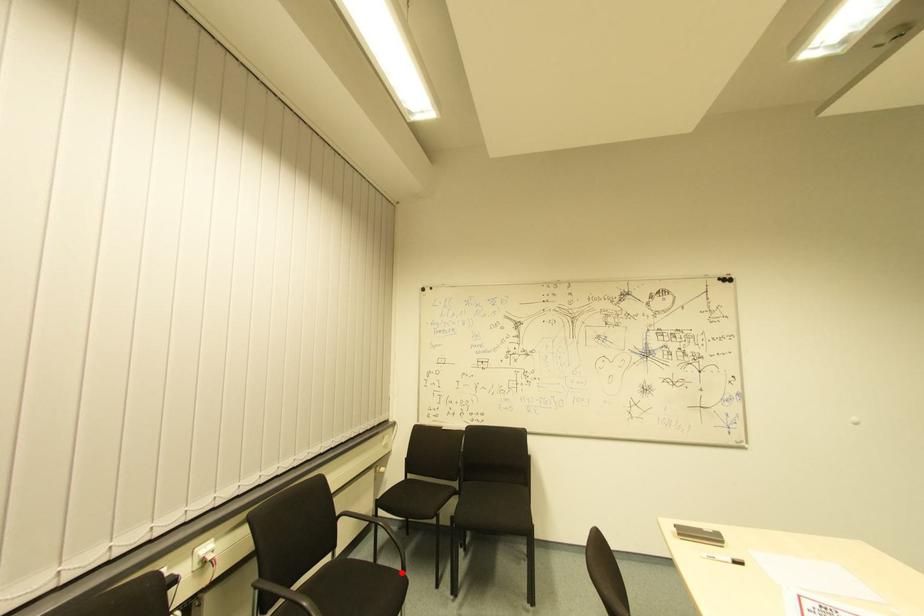
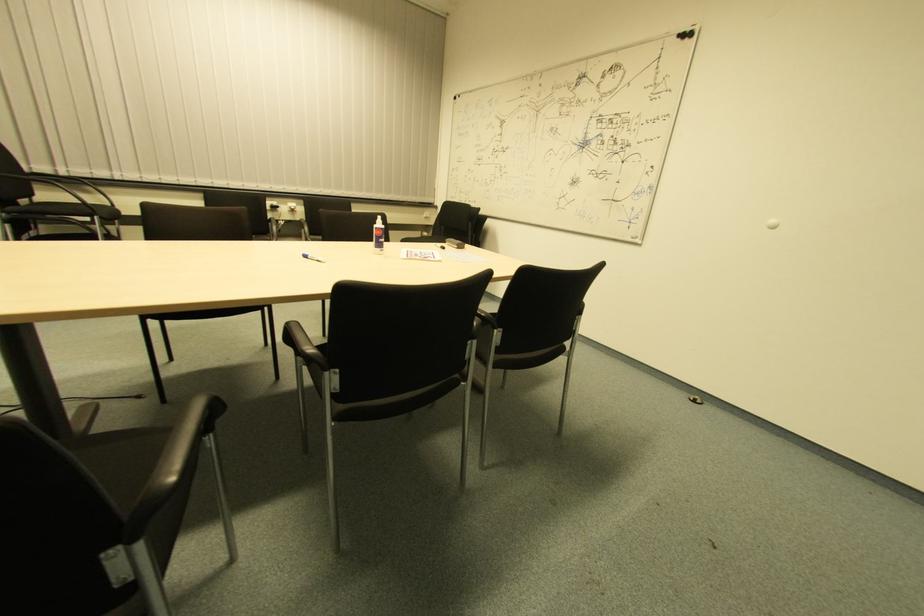
Question: I am providing you with two images of the same scene from different viewpoints. A red point is marked on the first image. Can you still see the location of the red point in image 2?

Choices:
 (A) Yes
 (B) No

Answer: (B)